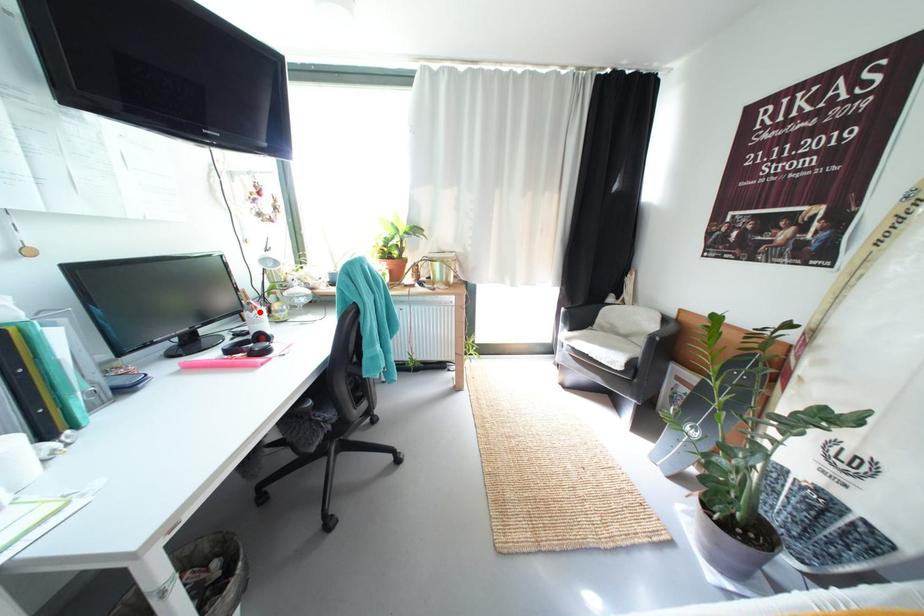
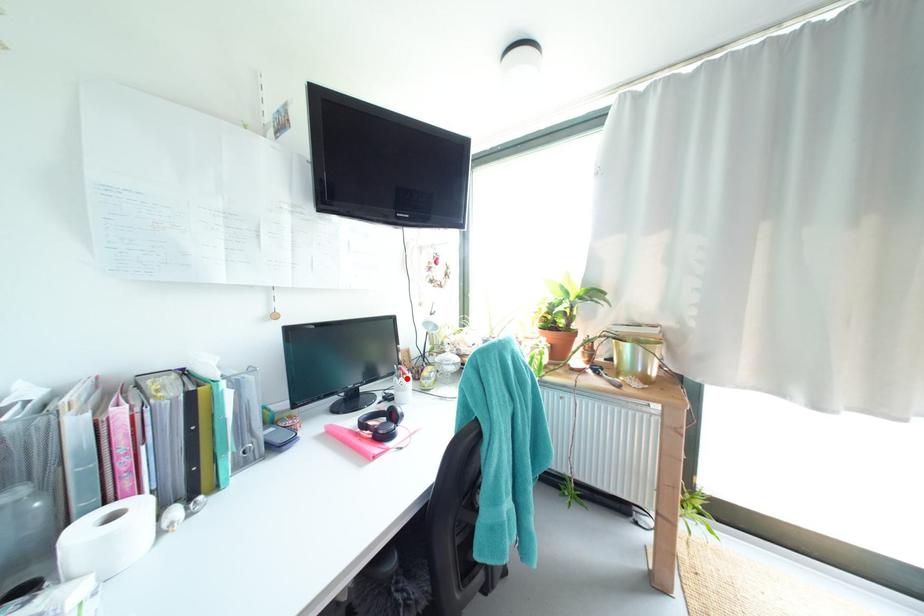
I am providing you with two images of the same scene from different viewpoints. A red point is marked on the first image and another point is marked on the second image. Does the point marked in image1 correspond to the same location as the one in image2?

Yes